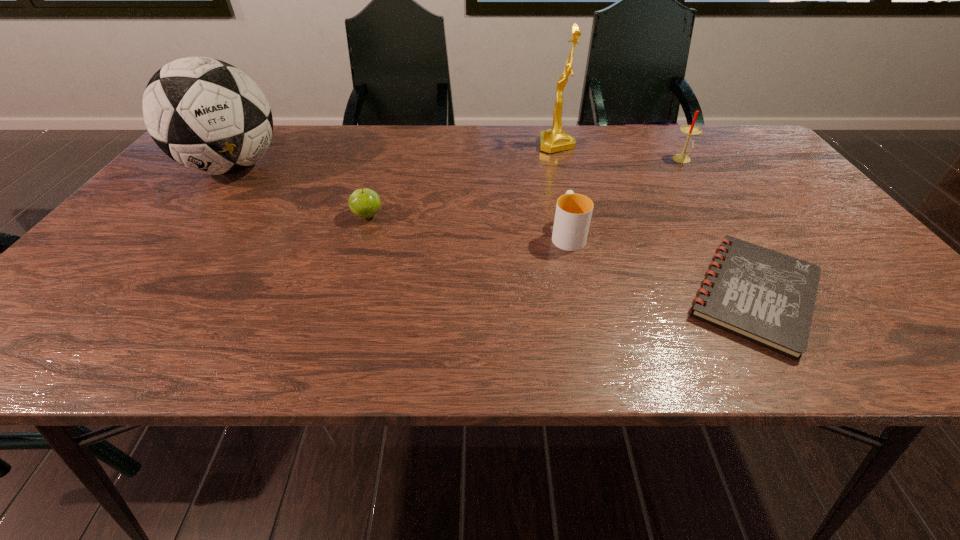
Locate an element on the screen. The height and width of the screenshot is (540, 960). free space between the shortest object and the third tallest object is located at coordinates pyautogui.click(x=718, y=227).

You are a GUI agent. You are given a task and a screenshot of the screen. Output one action in this format:
    pyautogui.click(x=<x>, y=<y>)
    Task: Click on the free space between the fifth object from right to left and the cup
    
    Given the screenshot: What is the action you would take?
    pyautogui.click(x=468, y=225)

The height and width of the screenshot is (540, 960). Identify the location of vacant space that is in between the fourth shortest object and the fifth tallest object. (525, 188).

Where is `free space between the fourth tallest object and the second object from left to right`? free space between the fourth tallest object and the second object from left to right is located at coordinates (468, 225).

This screenshot has height=540, width=960. I want to click on vacant area between the candle and the cup, so click(x=625, y=197).

Where is `free space between the second shortest object and the cup`? The image size is (960, 540). free space between the second shortest object and the cup is located at coordinates (468, 225).

Find the location of a particular element. The image size is (960, 540). free area in between the soccer ball and the shortest object is located at coordinates (493, 231).

Find the location of a particular element. The height and width of the screenshot is (540, 960). free spot between the cup and the second object from left to right is located at coordinates (468, 225).

Where is `vacant region between the notebook and the award`? Image resolution: width=960 pixels, height=540 pixels. vacant region between the notebook and the award is located at coordinates pyautogui.click(x=655, y=219).

Where is `empty space that is in between the candle and the second shortest object`? This screenshot has height=540, width=960. empty space that is in between the candle and the second shortest object is located at coordinates (525, 188).